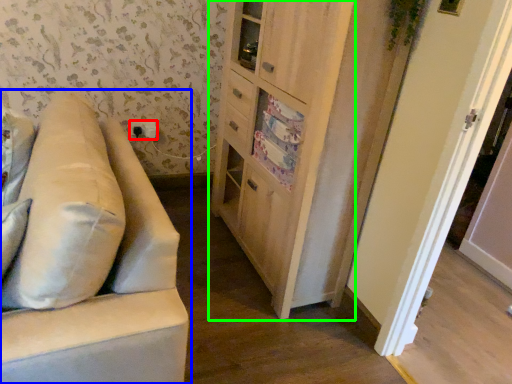
Question: Which is nearer to the electric outlet (highlighted by a red box)? studio couch (highlighted by a blue box) or cabinetry (highlighted by a green box).

Choices:
 (A) studio couch
 (B) cabinetry

Answer: (B)